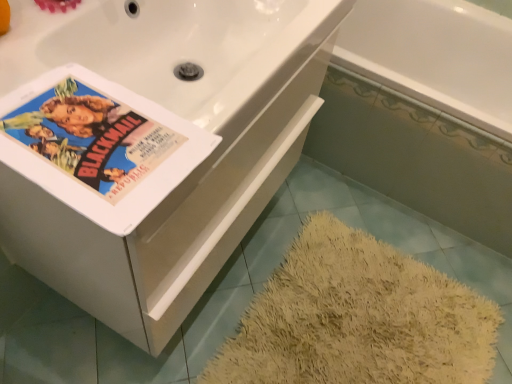
Where is `vacant location below matte paper poster at upper left (from a real-world perspective)`? vacant location below matte paper poster at upper left (from a real-world perspective) is located at coordinates pos(92,142).